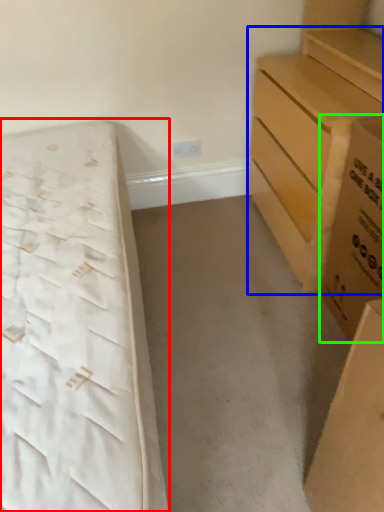
Question: Estimate the real-world distances between objects in this image. Which object is closer to bed (highlighted by a red box), chest of drawers (highlighted by a blue box) or cardboard box (highlighted by a green box)?

Choices:
 (A) chest of drawers
 (B) cardboard box

Answer: (A)